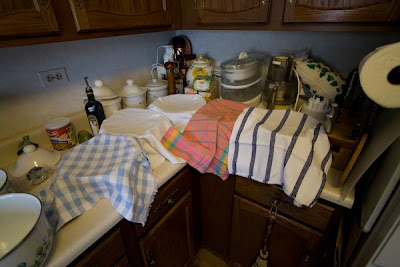
Where is `lower cabinets`? This screenshot has height=267, width=400. lower cabinets is located at coordinates (253, 226), (179, 220), (119, 260).